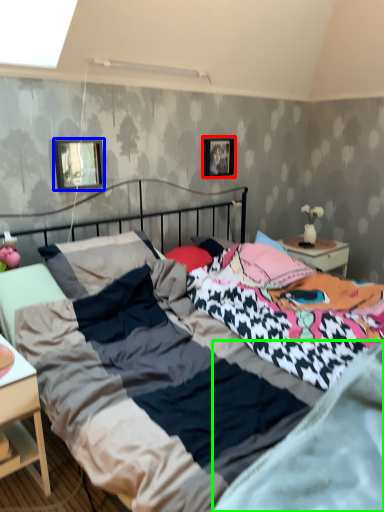
Question: Considering the real-world distances, which object is closest to picture frame (highlighted by a red box)? picture frame (highlighted by a blue box) or mattress (highlighted by a green box).

Choices:
 (A) picture frame
 (B) mattress

Answer: (A)